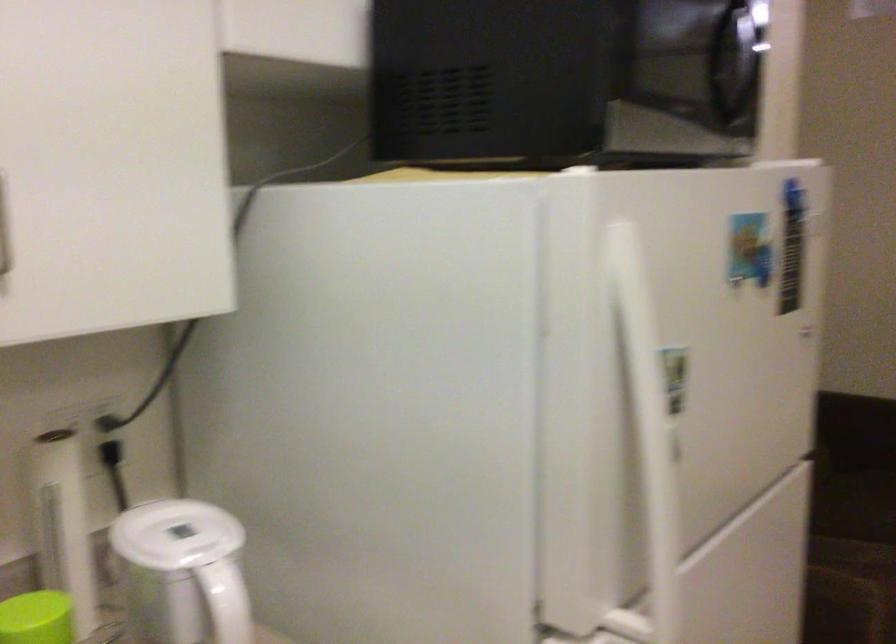
The images are taken continuously from a first-person perspective. In which direction is your viewpoint rotating?

The rotation direction of the camera is right-down.